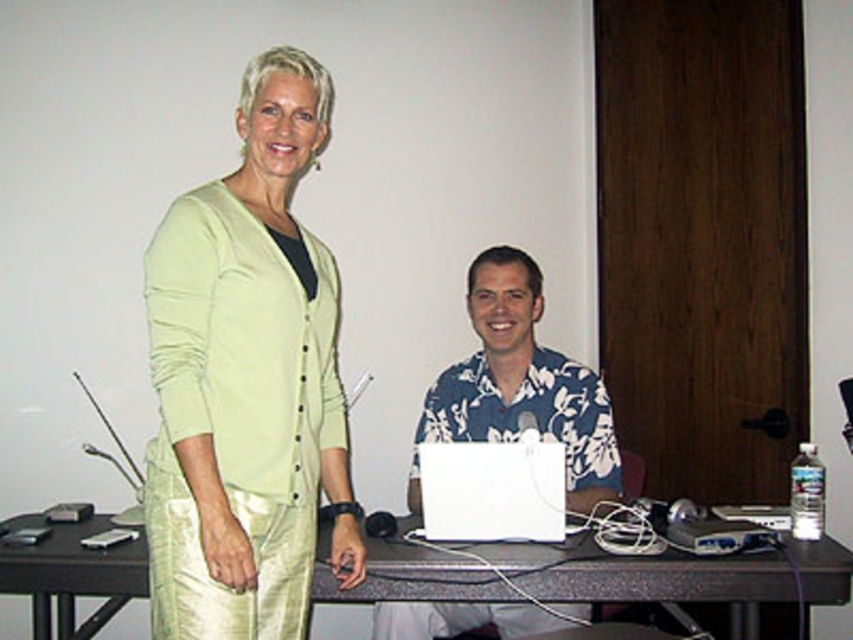
Question: Is matte green cardigan at upper left smaller than light green fabric cardigan at upper left?

Choices:
 (A) yes
 (B) no

Answer: (A)

Question: From the image, what is the correct spatial relationship of matte green cardigan at upper left in relation to blue floral shirt at center?

Choices:
 (A) above
 (B) below

Answer: (A)

Question: Among these points, which one is nearest to the camera?

Choices:
 (A) (289, 380)
 (B) (444, 632)
 (C) (209, 497)
 (D) (550, 525)

Answer: (C)

Question: From the image, what is the correct spatial relationship of smooth gray table at center in relation to white matte laptop at center?

Choices:
 (A) left
 (B) right

Answer: (B)

Question: Which of the following is the farthest from the observer?

Choices:
 (A) (590, 372)
 (B) (514, 492)

Answer: (A)

Question: Among these points, which one is farthest from the camera?

Choices:
 (A) (248, 531)
 (B) (341, 506)
 (C) (491, 483)

Answer: (C)